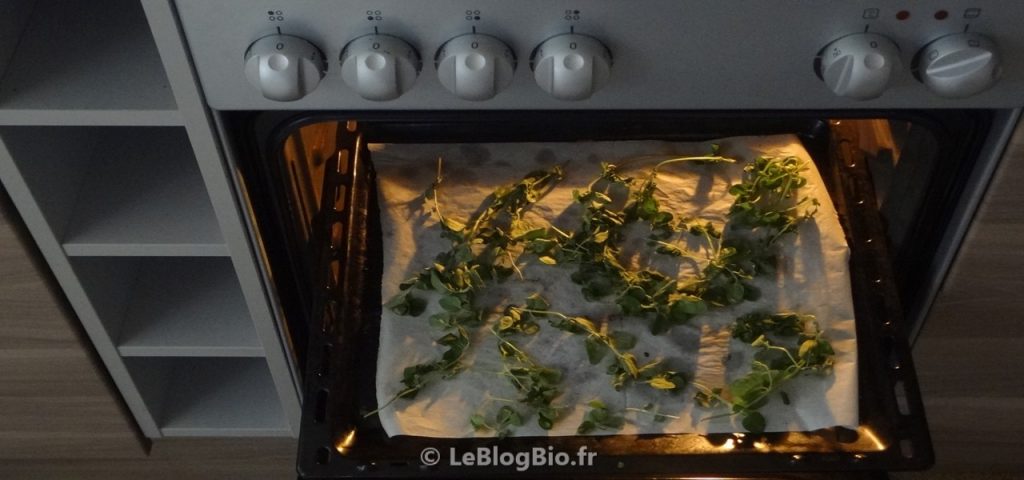
Where is `shelve`? The image size is (1024, 480). shelve is located at coordinates (137, 213).